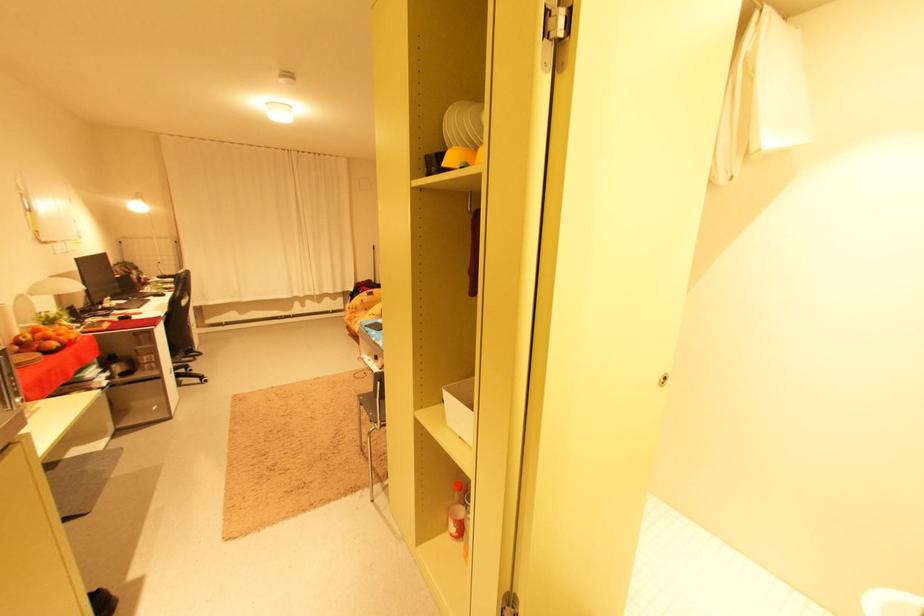
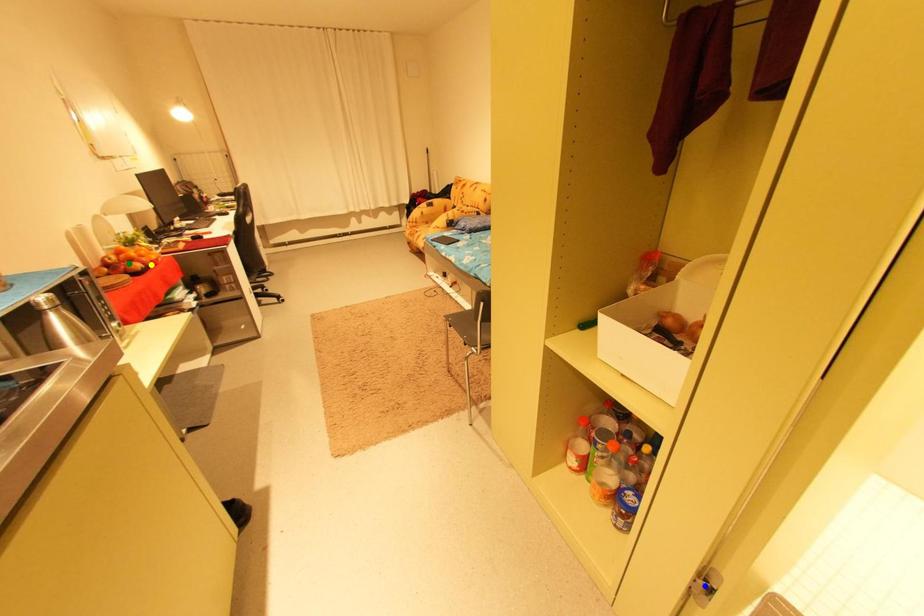
Question: I am providing you with two images of the same scene from different viewpoints. A red point is marked on the first image. You are given multiple points on the second image. Can you choose the point in image 2 that corresponds to the point in image 1?

Choices:
 (A) yellow point
 (B) green point
 (C) blue point

Answer: (A)